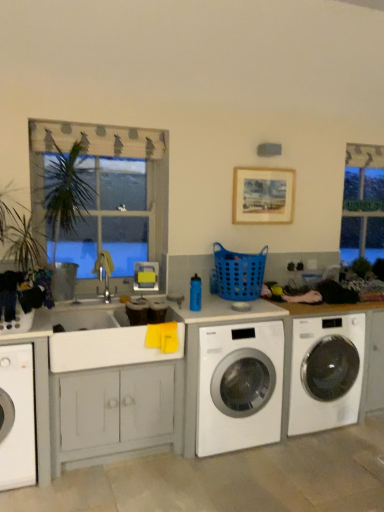
Question: Considering the positions of white glossy washing machine at center, which is the second washing machine in left-to-right order, and wooden framed artwork at upper center in the image, is white glossy washing machine at center, which is the second washing machine in left-to-right order, wider or thinner than wooden framed artwork at upper center?

Choices:
 (A) thin
 (B) wide

Answer: (B)

Question: In terms of height, does white glossy washing machine at center, which is the second washing machine in left-to-right order, look taller or shorter compared to wooden framed artwork at upper center?

Choices:
 (A) tall
 (B) short

Answer: (A)

Question: Based on their relative distances, which object is nearer to the white glossy washing machine at lower left, the 3th washing machine in the right-to-left sequence?

Choices:
 (A) white glossy washing machine at center, which appears as the first washing machine when viewed from the right
 (B) green glass sign at upper right
 (C) wooden framed artwork at upper center
 (D) blue plastic basket at center
 (E) wooden frame at upper left

Answer: (E)

Question: Estimate the real-world distances between objects in this image. Which object is farther from the white glossy washing machine at center, the 3th washing machine in the left-to-right sequence?

Choices:
 (A) wooden framed artwork at upper center
 (B) white glossy washing machine at lower left, the first washing machine in the left-to-right sequence
 (C) green glass sign at upper right
 (D) blue plastic basket at center
 (E) wooden frame at upper left

Answer: (B)